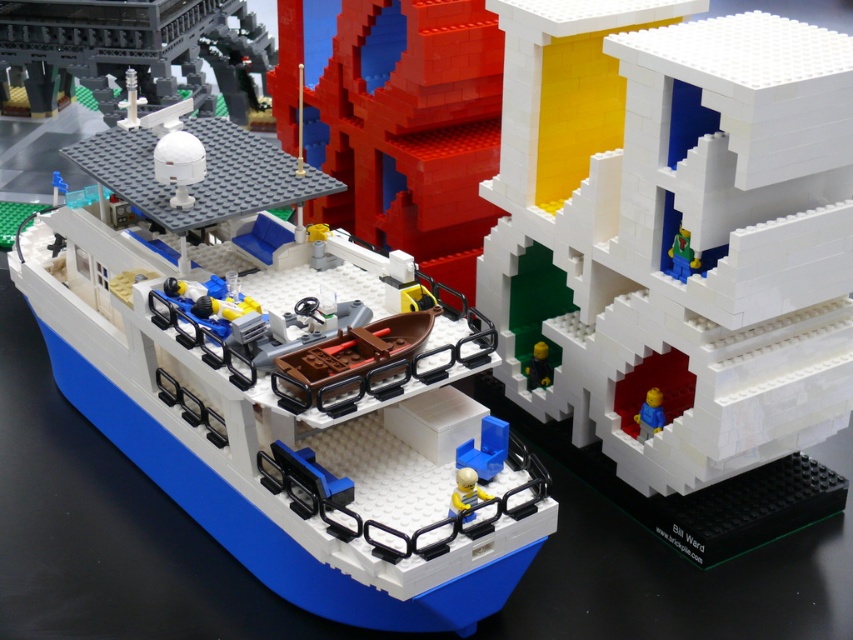
You are a photographer standing 2 meters away from a Lego ship model. You want to capture a closeup shot of the smooth white sphere at upper left without moving your camera. Is the sphere within your current camera range?

The smooth white sphere at upper left is 1.82 meters away from camera, so yes, it is within the photographer standing 2 meters away from the Lego ship model. The sphere is close enough to be captured in a closeup shot without moving the camera.

You are a Lego figure standing at the ship deck and looking at two points in the scene. One is at point (97, 60) and the other is at point (653, 417). Which point is closer to you?

Point (97, 60) is closer to you because it is further to the viewer than point (653, 417).